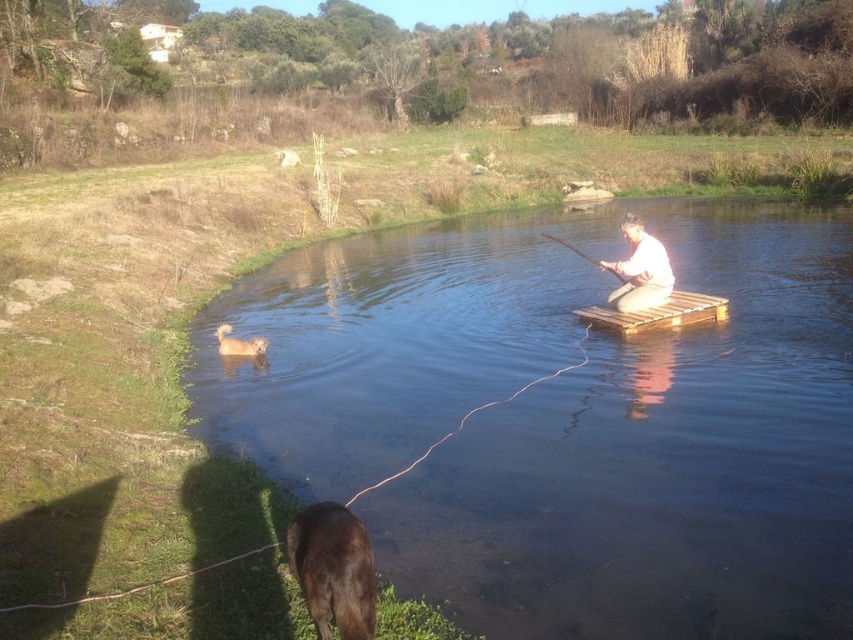
Is brown furry dog at lower center shorter than wooden stick at center?

Yes, brown furry dog at lower center is shorter than wooden stick at center.

Does brown furry dog at lower center appear on the right side of wooden stick at center?

Incorrect, brown furry dog at lower center is not on the right side of wooden stick at center.

Is point (296, 563) more distant than point (601, 266)?

No, it is not.

In order to click on brown furry dog at lower center in this screenshot , I will do `click(334, 570)`.

In the scene shown: Which of these two, white cotton shirt at center or fuzzy beige dog at lower left, stands taller?

Standing taller between the two is white cotton shirt at center.

Does white cotton shirt at center have a larger size compared to fuzzy beige dog at lower left?

Yes.

Which is in front, point (639, 298) or point (251, 349)?

Point (639, 298)

The width and height of the screenshot is (853, 640). Identify the location of white cotton shirt at center. (640, 269).

Can you confirm if white cotton shirt at center is thinner than wooden pallet at center?

Correct, white cotton shirt at center's width is less than wooden pallet at center's.

Can you confirm if white cotton shirt at center is taller than wooden pallet at center?

Yes.

Find the location of a particular element. This screenshot has height=640, width=853. white cotton shirt at center is located at coordinates (640, 269).

Find the location of a particular element. white cotton shirt at center is located at coordinates (640, 269).